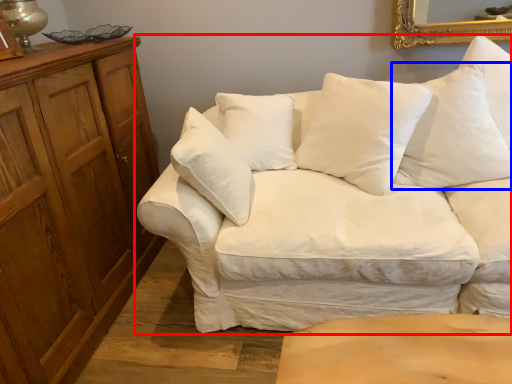
Question: Which point is closer to the camera, studio couch (highlighted by a red box) or pillow (highlighted by a blue box)?

Choices:
 (A) studio couch
 (B) pillow

Answer: (A)